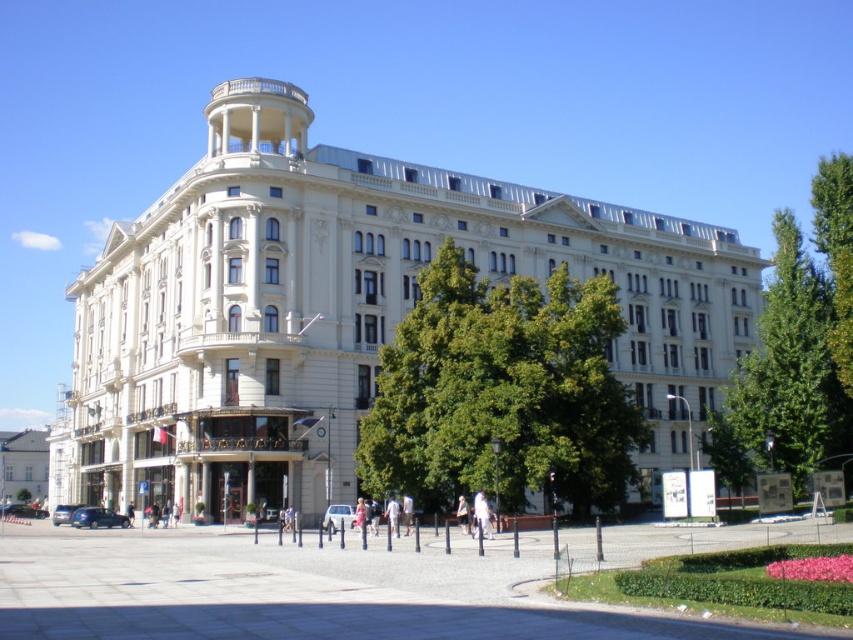
Is green leafy tree at center thinner than green textured tree at right?

Indeed, green leafy tree at center has a lesser width compared to green textured tree at right.

How much distance is there between green leafy tree at center and green textured tree at right?

green leafy tree at center and green textured tree at right are 19.27 meters apart.

Between point (372, 413) and point (820, 168), which one is positioned in front?

Positioned in front is point (372, 413).

At what (x,y) coordinates should I click in order to perform the action: click on green leafy tree at center. Please return your answer as a coordinate pair (x, y). Looking at the image, I should click on (502, 392).

Describe the element at coordinates (502, 392) in the screenshot. Image resolution: width=853 pixels, height=640 pixels. I see `green leafy tree at center` at that location.

Is green leafy tree at center closer to camera compared to green leafy tree at right?

Yes, green leafy tree at center is closer to the viewer.

Is point (566, 288) less distant than point (807, 461)?

Yes, it is in front of point (807, 461).

Image resolution: width=853 pixels, height=640 pixels. In order to click on green leafy tree at center in this screenshot , I will do `click(502, 392)`.

Who is more distant from viewer, (717,445) or (9,484)?

The point (9,484) is behind.

In the scene shown: Can you confirm if green leafy tree at right is wider than white glossy building at lower left?

Yes, green leafy tree at right is wider than white glossy building at lower left.

Describe the element at coordinates (786, 380) in the screenshot. This screenshot has height=640, width=853. I see `green leafy tree at right` at that location.

Where is `green leafy tree at right`? The height and width of the screenshot is (640, 853). green leafy tree at right is located at coordinates (786, 380).